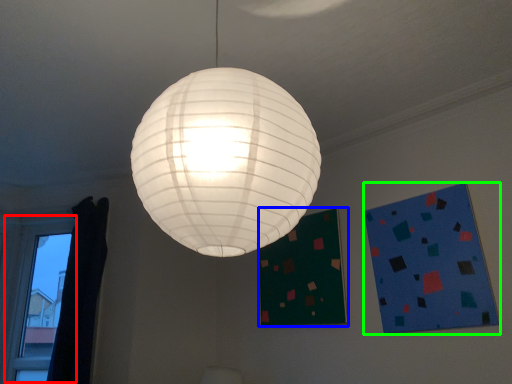
Question: Which is farther away from window (highlighted by a red box)? bulletin board (highlighted by a blue box) or design (highlighted by a green box)?

Choices:
 (A) bulletin board
 (B) design

Answer: (B)